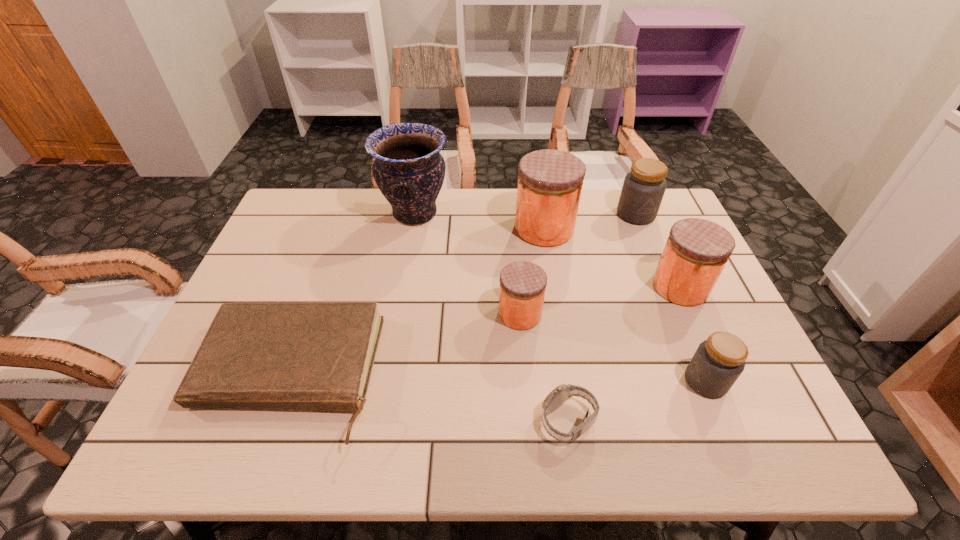
Identify the location of vacant space at the far left corner. This screenshot has height=540, width=960. (313, 217).

Where is `vacant region at the near left corner`? Image resolution: width=960 pixels, height=540 pixels. vacant region at the near left corner is located at coordinates (173, 429).

Find the location of `free area in between the nearest jar and the rightmost orange jar`. free area in between the nearest jar and the rightmost orange jar is located at coordinates (693, 334).

This screenshot has height=540, width=960. In order to click on free spot between the nearer gray jar and the shortest object in this screenshot , I will do `click(497, 379)`.

The width and height of the screenshot is (960, 540). Identify the location of unoccupied area between the rightmost orange jar and the nearer gray jar. [x=693, y=334].

The height and width of the screenshot is (540, 960). In order to click on vacant point located between the smaller gray jar and the rightmost orange jar in this screenshot , I will do `click(693, 334)`.

Where is `vacant space that's between the rightmost orange jar and the farther gray jar`? The width and height of the screenshot is (960, 540). vacant space that's between the rightmost orange jar and the farther gray jar is located at coordinates pyautogui.click(x=659, y=251).

Locate an element on the screen. The height and width of the screenshot is (540, 960). free space between the second smallest orange jar and the paperback book is located at coordinates (485, 332).

Select which object is the sixth closest to the smaller gray jar. Please provide its 2D coordinates. Your answer should be formatted as a tuple, i.e. [(x, y)], where the tuple contains the x and y coordinates of a point satisfying the conditions above.

[(291, 356)]

This screenshot has width=960, height=540. What are the coordinates of `the fifth closest object to the biggest orange jar` in the screenshot? It's located at (291, 356).